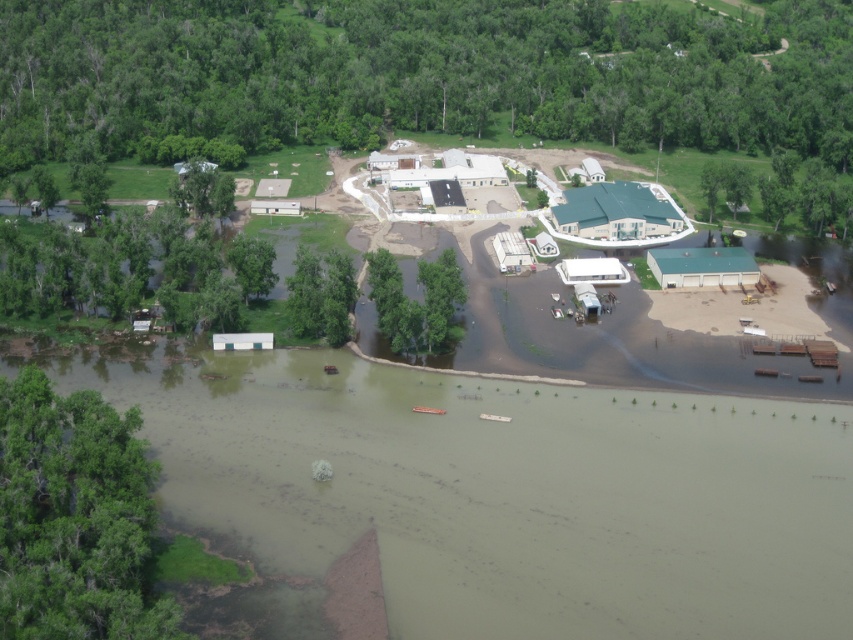
You are a bird flying over the flooded area and want to land on a tree. Which tree is closer to the left side of the scene, the green leafy tree at lower left or the green leafy tree at center?

The green leafy tree at lower left is positioned on the left side of the green leafy tree at center, so it is closer to the left side of the scene.

You are a bird flying over the flooded area. You see the green leafy tree at upper center and the green leafy tree at lower left. Which tree is closer to you?

The green leafy tree at upper center is closer to you because the green leafy tree at lower left is behind it.